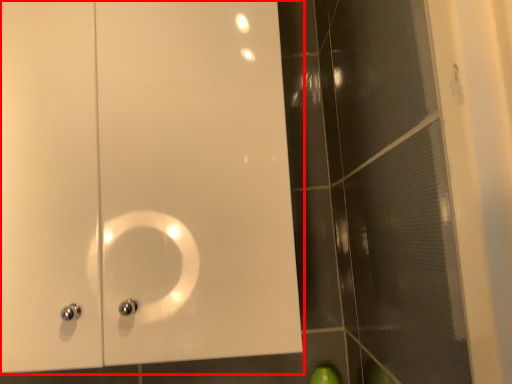
Question: Where is door (annotated by the red box) located in relation to glass door in the image?

Choices:
 (A) left
 (B) right

Answer: (A)